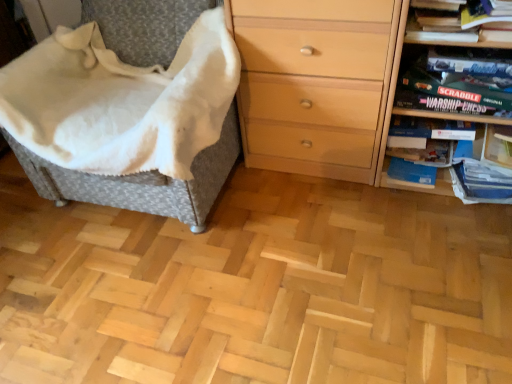
This screenshot has height=384, width=512. I want to click on spots to the right of woven fabric chair at left, so click(318, 218).